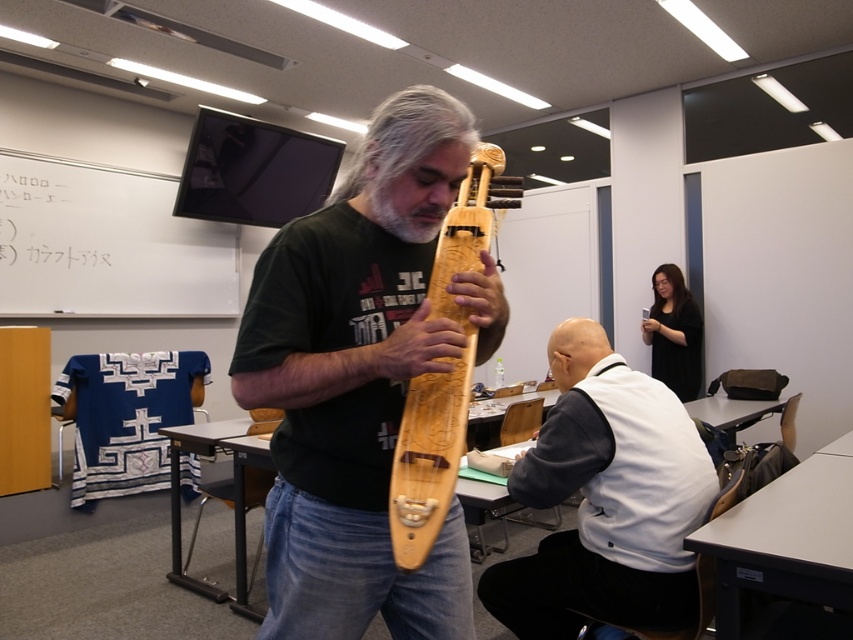
You are organizing a music workshop and need to place the wooden carved instrument at center and the white matte vest at center on a narrow shelf. Which object should you place first to ensure they both fit on the shelf without overlapping?

The wooden carved instrument at center has a lesser width compared to the white matte vest at center, so you should place the white matte vest at center first to ensure there is enough space for both items on the narrow shelf.

Looking at this image, you are organizing a small performance in the classroom and need to ensure there is enough space between the white matte vest at center and the wooden carved guitar at center for a performer to move comfortably. What should you consider?

The white matte vest at center might be wider than the wooden carved guitar at center, so you should measure the space between them to ensure there is adequate room for the performer to move comfortably.

You are organizing a display in this classroom and need to know which item takes up more space. Which one is larger between the wooden carved instrument at center and the white matte vest at center?

The wooden carved instrument at center occupies less space than the white matte vest at center, so the white matte vest at center is larger.